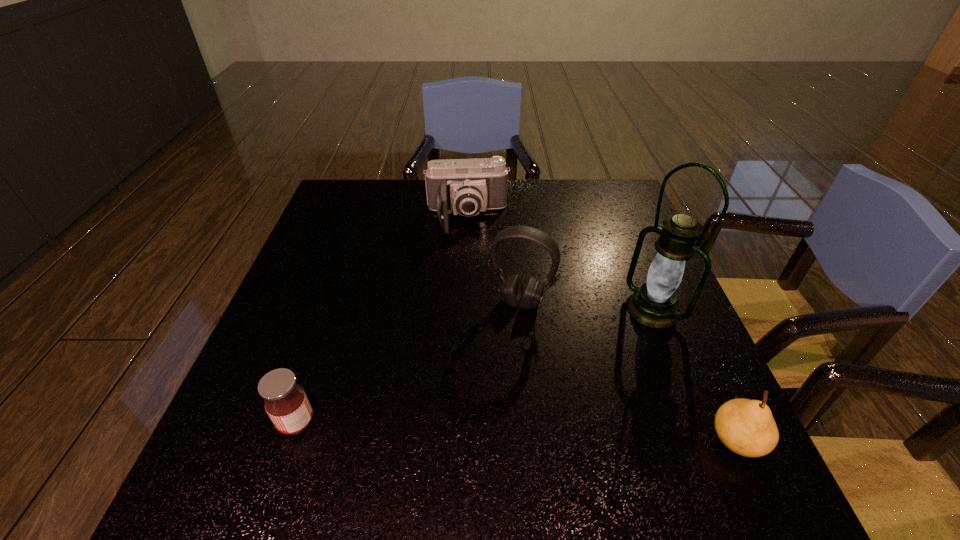
Locate an element on the screen. Image resolution: width=960 pixels, height=540 pixels. empty location between the leftmost object and the farthest object is located at coordinates (382, 320).

Where is `vacant area that lies between the camera and the pear`? The width and height of the screenshot is (960, 540). vacant area that lies between the camera and the pear is located at coordinates (602, 329).

I want to click on vacant space in between the farthest object and the leftmost object, so click(382, 320).

The height and width of the screenshot is (540, 960). In order to click on free space between the pear and the camera in this screenshot , I will do `click(602, 329)`.

Identify the location of free spot between the pear and the camera. pos(602,329).

Locate an element on the screen. This screenshot has width=960, height=540. vacant space that is in between the camera and the pear is located at coordinates (602, 329).

This screenshot has height=540, width=960. Identify the location of free space between the pear and the second tallest object. (629, 371).

Image resolution: width=960 pixels, height=540 pixels. I want to click on free area in between the lantern and the leftmost object, so click(x=474, y=366).

Locate which object ranks in proximity to the jam. Please provide its 2D coordinates. Your answer should be formatted as a tuple, i.e. [(x, y)], where the tuple contains the x and y coordinates of a point satisfying the conditions above.

[(511, 290)]

Locate an element on the screen. The image size is (960, 540). the fourth closest object to the fourth shortest object is located at coordinates (286, 403).